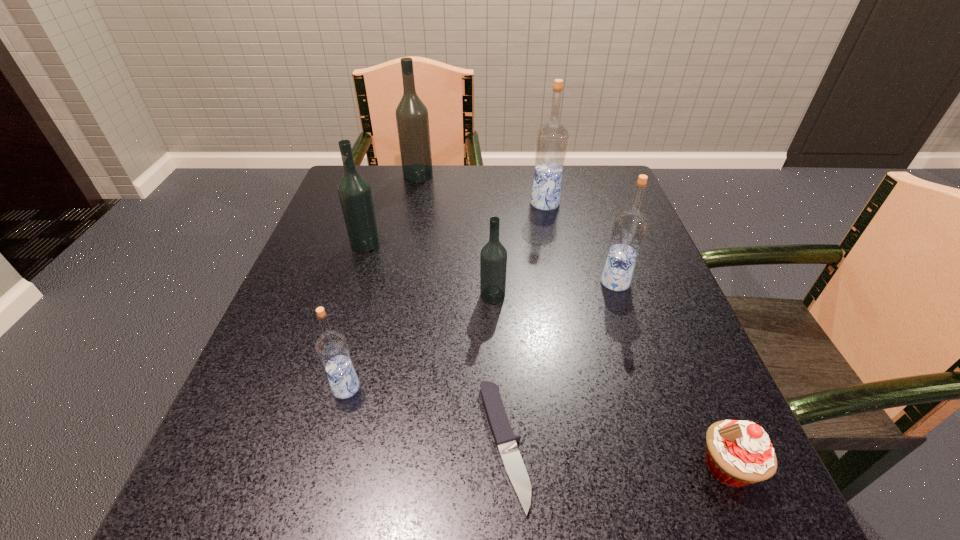
In the image, there is a desktop. Where is `vacant space at the left edge`? The width and height of the screenshot is (960, 540). vacant space at the left edge is located at coordinates (235, 455).

Identify the location of free region at the right edge of the desktop. The image size is (960, 540). (639, 265).

This screenshot has height=540, width=960. In order to click on free space at the far left corner of the desktop in this screenshot , I will do `click(326, 213)`.

The image size is (960, 540). In order to click on blank space at the far right corner of the desktop in this screenshot , I will do `click(563, 180)`.

The width and height of the screenshot is (960, 540). Find the location of `free space between the third object from right to left and the steak knife`. free space between the third object from right to left and the steak knife is located at coordinates (524, 324).

Where is `vacant space that's between the nearest black vodka and the cupcake`? The height and width of the screenshot is (540, 960). vacant space that's between the nearest black vodka and the cupcake is located at coordinates (610, 381).

Where is `vacant space in between the shortest object and the rightmost vodka`? vacant space in between the shortest object and the rightmost vodka is located at coordinates pos(560,363).

Locate an element on the screen. vacant space that's between the farthest object and the second smallest black vodka is located at coordinates (392, 209).

Identify the location of vacant area between the smallest blue vodka and the third object from right to left. This screenshot has width=960, height=540. (445, 295).

Image resolution: width=960 pixels, height=540 pixels. I want to click on free spot between the rightmost vodka and the fifth vodka from left to right, so click(x=580, y=243).